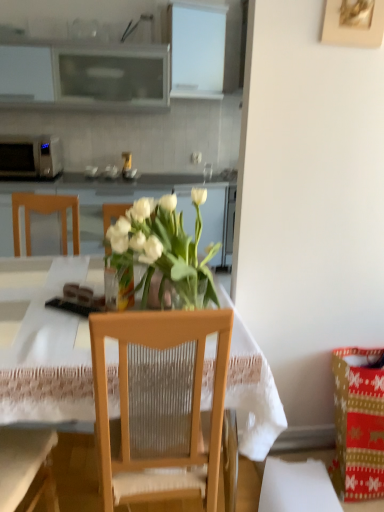
Where is `wooden chair at center`? Image resolution: width=384 pixels, height=512 pixels. wooden chair at center is located at coordinates (160, 404).

Describe the element at coordinates (207, 172) in the screenshot. I see `matte glass coffee cup at center` at that location.

Measure the distance between clear glass vase at center and camera.

They are 4.66 feet apart.

The image size is (384, 512). Describe the element at coordinates (118, 289) in the screenshot. I see `clear glass vase at center` at that location.

The width and height of the screenshot is (384, 512). I want to click on wooden picture frame at upper right, so click(353, 23).

Identify the location of white glossy cabinet at center. (98, 201).

Considering the positions of point (112, 273) and point (110, 490), is point (112, 273) closer or farther from the camera than point (110, 490)?

Point (112, 273) appears to be farther away from the viewer than point (110, 490).

Measure the distance from clear glass vase at center to wooden chair at center.

A distance of 17.16 inches exists between clear glass vase at center and wooden chair at center.

From their relative heights in the image, would you say clear glass vase at center is taller or shorter than wooden chair at center?

Considering their sizes, clear glass vase at center has less height than wooden chair at center.

From the image's perspective, is clear glass vase at center on wooden chair at center?

Yes, from the image's perspective, clear glass vase at center is over wooden chair at center.

From a real-world perspective, which object rests below the other?

In real-world perspective, wooden chair at center is lower.

Which object is positioned more to the right, wooden chair at center or clear glass vase at center?

wooden chair at center.

Can you confirm if wooden chair at center is taller than clear glass vase at center?

Indeed, wooden chair at center has a greater height compared to clear glass vase at center.

Which point is more distant from viewer, (191, 226) or (126, 297)?

The point (191, 226) is farther from the camera.

I want to click on vase below the white glossy cabinet at center (from the image's perspective), so click(x=118, y=289).

Would you consider white glossy cabinet at center to be distant from clear glass vase at center?

white glossy cabinet at center is far away from clear glass vase at center.

Is wooden picture frame at upper right smaller than transparent glass vase at center?

Correct, wooden picture frame at upper right occupies less space than transparent glass vase at center.

Locate an element on the screen. desk located below the wooden picture frame at upper right (from the image's perspective) is located at coordinates (45, 345).

Are wooden picture frame at upper right and transparent glass vase at center located far from each other?

Yes, wooden picture frame at upper right is far from transparent glass vase at center.

Who is taller, wooden picture frame at upper right or transparent glass vase at center?

Standing taller between the two is transparent glass vase at center.

Is wooden picture frame at upper right outside of white glossy cabinet at center?

Yes, wooden picture frame at upper right is located beyond the bounds of white glossy cabinet at center.

Is wooden picture frame at upper right not close to white glossy cabinet at center?

Yes.

Considering the sizes of objects wooden picture frame at upper right and white glossy cabinet at center in the image provided, who is smaller, wooden picture frame at upper right or white glossy cabinet at center?

wooden picture frame at upper right.

Is wooden picture frame at upper right facing away from white glossy cabinet at center?

wooden picture frame at upper right is not turned away from white glossy cabinet at center.

Measure the distance between wooden picture frame at upper right and white matte microwave oven at left.

wooden picture frame at upper right is 8.62 feet away from white matte microwave oven at left.

Is wooden picture frame at upper right aimed at white matte microwave oven at left?

No, wooden picture frame at upper right is not turned towards white matte microwave oven at left.

Considering the relative sizes of wooden picture frame at upper right and white matte microwave oven at left in the image provided, is wooden picture frame at upper right wider than white matte microwave oven at left?

No.

Is wooden picture frame at upper right in front of or behind wooden chair at center in the image?

wooden picture frame at upper right is behind wooden chair at center.

Who is bigger, wooden picture frame at upper right or wooden chair at center?

With larger size is wooden chair at center.

Which point is more distant from viewer, (366,27) or (130,396)?

The point (366,27) is farther from the camera.

At what (x,y) coordinates should I click in order to perform the action: click on vase to the left of wooden chair at center. Please return your answer as a coordinate pair (x, y). The width and height of the screenshot is (384, 512). Looking at the image, I should click on (118, 289).

Locate an element on the screen. The width and height of the screenshot is (384, 512). chair below the clear glass vase at center (from the image's perspective) is located at coordinates (160, 404).

When comparing their distances from clear glass vase at center, does wooden picture frame at upper right or wooden chair at center seem closer?

wooden chair at center is positioned closer to the anchor clear glass vase at center.

Estimate the real-world distances between objects in this image. Which object is closer to white matte microwave oven at left, matte glass coffee cup at center or wooden chair at center?

Among the two, matte glass coffee cup at center is located nearer to white matte microwave oven at left.

Consider the image. Considering their positions, is transparent glass vase at center positioned further to clear glass vase at center than wooden chair at center?

wooden chair at center is positioned further to the anchor clear glass vase at center.

Looking at the image, which one is located closer to matte glass coffee cup at center, clear glass vase at center or wooden chair at center?

The object closer to matte glass coffee cup at center is clear glass vase at center.

From the picture: From the image, which object appears to be farther from transparent glass vase at center, matte glass coffee cup at center or white glossy cabinet at center?

matte glass coffee cup at center is positioned further to the anchor transparent glass vase at center.

Estimate the real-world distances between objects in this image. Which object is further from clear glass vase at center, white glossy cabinet at center or white matte microwave oven at left?

white matte microwave oven at left lies further to clear glass vase at center than the other object.

Estimate the real-world distances between objects in this image. Which object is further from wooden picture frame at upper right, white glossy cabinet at center or wooden chair at center?

white glossy cabinet at center lies further to wooden picture frame at upper right than the other object.

Looking at the image, which one is located closer to clear glass vase at center, white glossy cabinet at center or transparent glass vase at center?

transparent glass vase at center is positioned closer to the anchor clear glass vase at center.

The height and width of the screenshot is (512, 384). I want to click on cabinetry positioned between transparent glass vase at center and matte glass coffee cup at center from near to far, so click(98, 201).

Where is `desk positioned between wooden chair at center and white matte microwave oven at left from near to far`? The height and width of the screenshot is (512, 384). desk positioned between wooden chair at center and white matte microwave oven at left from near to far is located at coordinates (45, 345).

Identify the location of vase between wooden picture frame at upper right and wooden chair at center vertically. (118, 289).

This screenshot has height=512, width=384. Find the location of `desk located between wooden chair at center and white glossy cabinet at center in the depth direction`. desk located between wooden chair at center and white glossy cabinet at center in the depth direction is located at coordinates (45, 345).